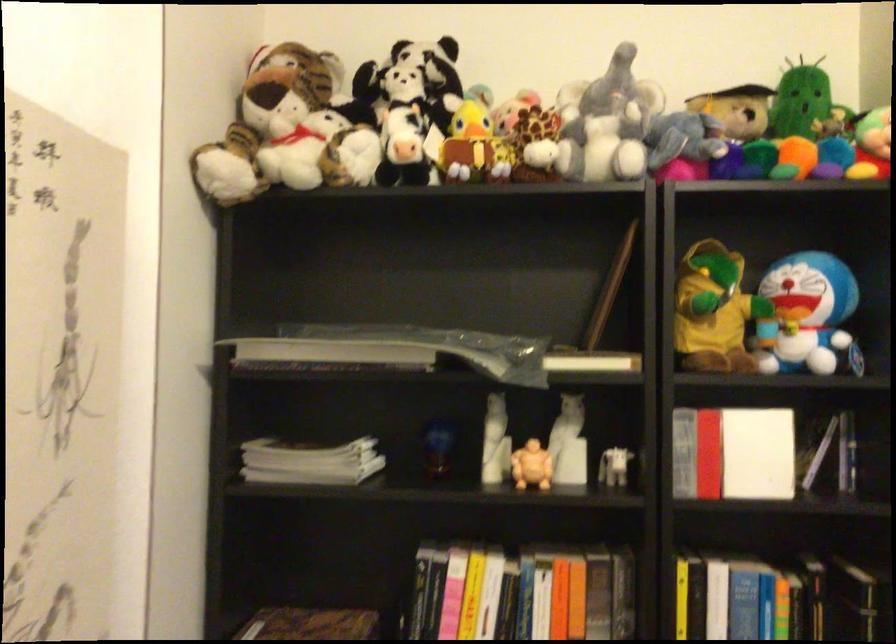
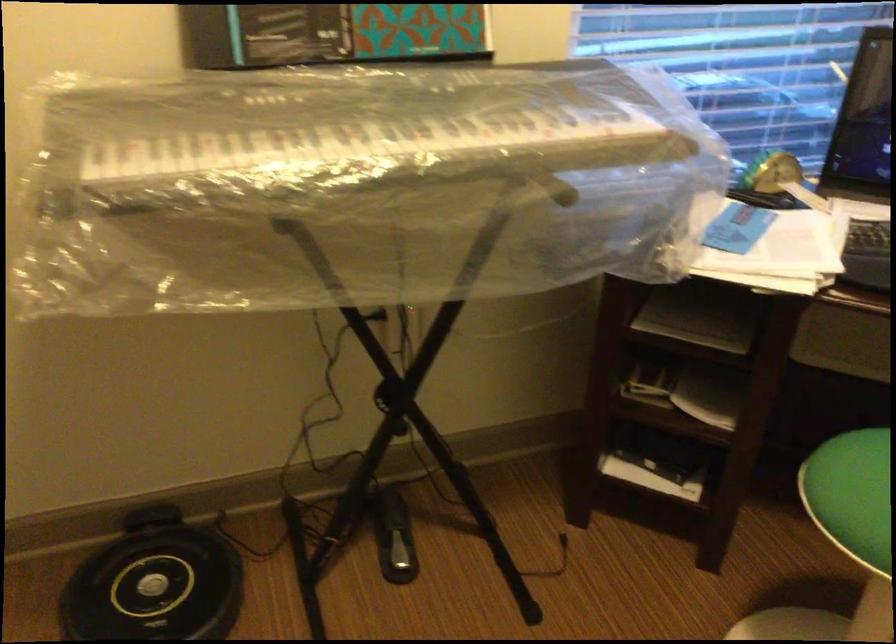
Based on the continuous images, in which direction is the camera rotating?

The camera rotated toward right-down.